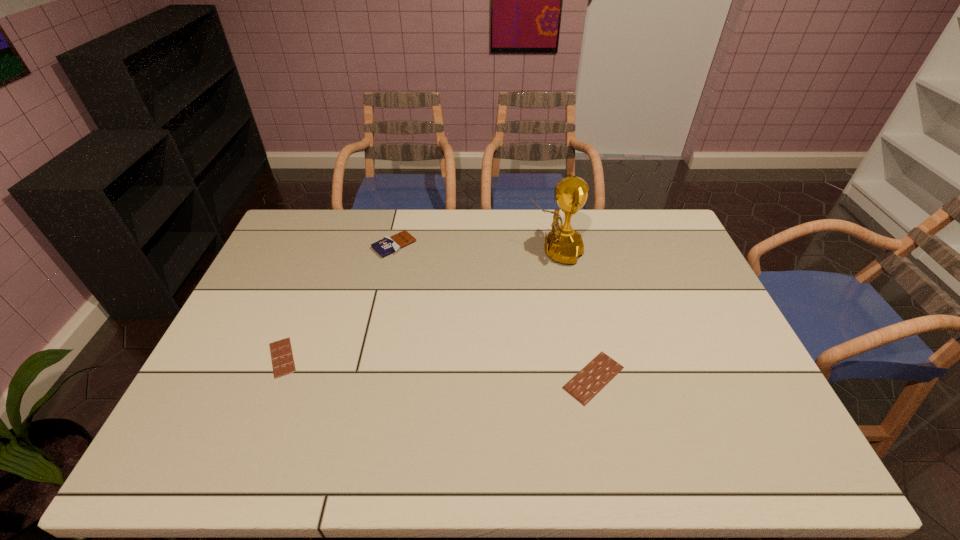
Find the location of `award`. award is located at coordinates (563, 244).

Where is `the farthest chocolate bar`? The image size is (960, 540). the farthest chocolate bar is located at coordinates (387, 245).

You are a GUI agent. You are given a task and a screenshot of the screen. Output one action in this format:
    pyautogui.click(x=<x>, y=<y>)
    Task: Click on the third object from right to left
    
    Given the screenshot: What is the action you would take?
    pyautogui.click(x=387, y=245)

Identify the location of the rightmost chocolate bar. Image resolution: width=960 pixels, height=540 pixels. (587, 383).

At what (x,y) coordinates should I click in order to perform the action: click on the second tallest chocolate bar. Please return your answer as a coordinate pair (x, y). Image resolution: width=960 pixels, height=540 pixels. Looking at the image, I should click on tap(587, 383).

Find the location of a particular element. This screenshot has height=540, width=960. the leftmost object is located at coordinates (282, 358).

I want to click on the shortest object, so tap(282, 358).

The width and height of the screenshot is (960, 540). Identify the location of vacant space situated on the front side of the tallest object. (470, 251).

Find the location of a particular element. This screenshot has width=960, height=540. free location located 0.070m on the front side of the tallest object is located at coordinates (508, 251).

This screenshot has height=540, width=960. What are the coordinates of `vacant space located 0.390m on the front side of the tallest object` in the screenshot? It's located at (416, 251).